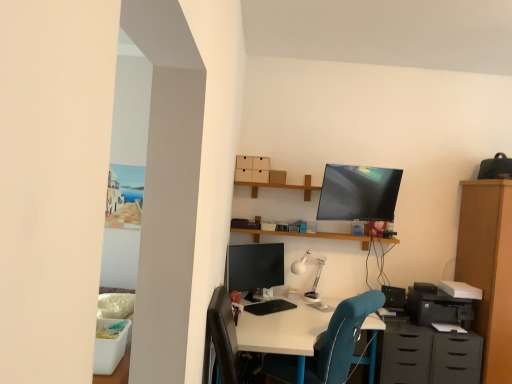
I want to click on free space below white matte desk lamp at center (from a real-world perspective), so click(x=306, y=304).